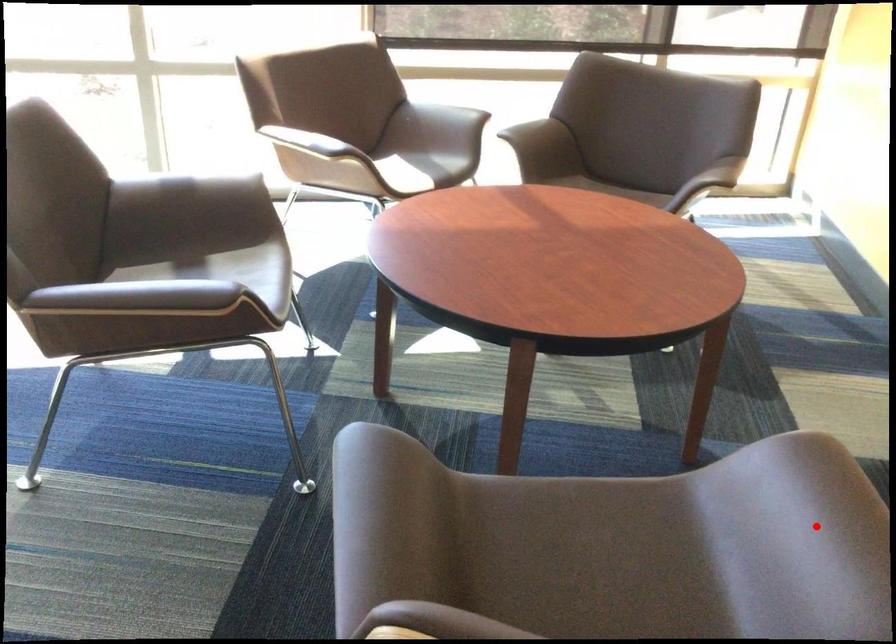
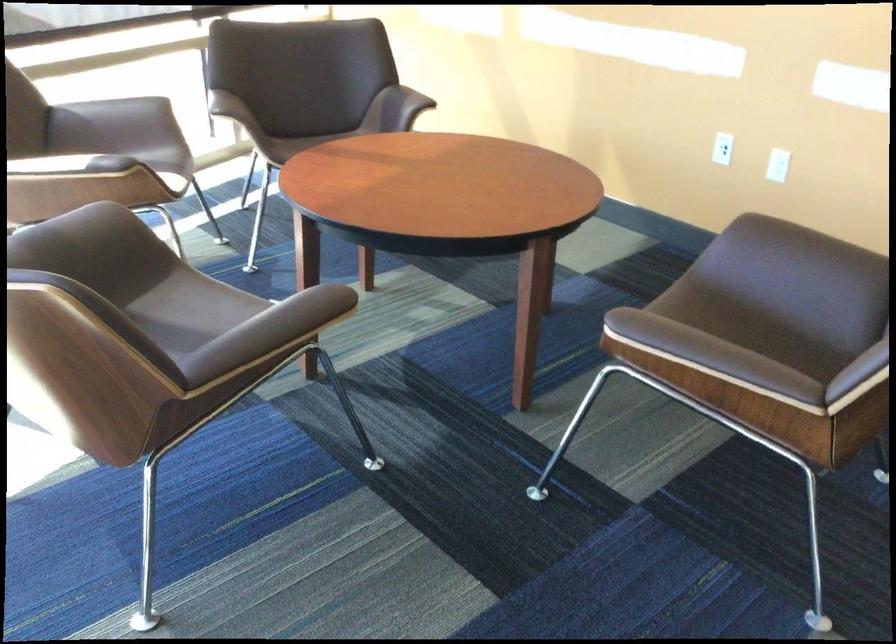
Question: I am providing you with two images of the same scene from different viewpoints. In image1, a red point is highlighted. Considering the same 3D point in image2, which of the following is correct?

Choices:
 (A) It is closer
 (B) It is farther

Answer: (B)